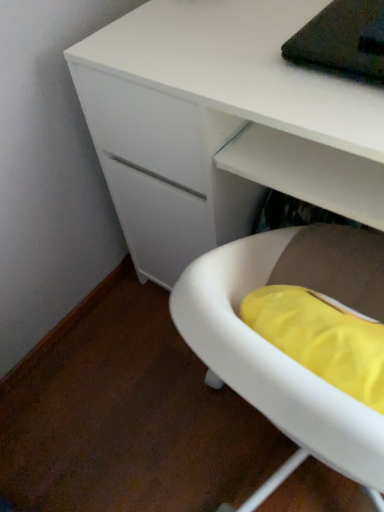
Question: Is white plastic tub at lower right at the left side of white matte desk at center?

Choices:
 (A) yes
 (B) no

Answer: (A)

Question: From the image's perspective, is white plastic tub at lower right below white matte desk at center?

Choices:
 (A) no
 (B) yes

Answer: (B)

Question: Considering the relative sizes of white plastic tub at lower right and white matte desk at center in the image provided, is white plastic tub at lower right bigger than white matte desk at center?

Choices:
 (A) yes
 (B) no

Answer: (B)

Question: From a real-world perspective, is white plastic tub at lower right positioned under white matte desk at center based on gravity?

Choices:
 (A) no
 (B) yes

Answer: (A)

Question: Is white plastic tub at lower right positioned behind white matte desk at center?

Choices:
 (A) no
 (B) yes

Answer: (A)

Question: Is white plastic tub at lower right positioned with its back to white matte desk at center?

Choices:
 (A) yes
 (B) no

Answer: (B)

Question: From a real-world perspective, is white matte desk at center below white plastic tub at lower right?

Choices:
 (A) no
 (B) yes

Answer: (B)

Question: Is white matte desk at center facing away from white plastic tub at lower right?

Choices:
 (A) yes
 (B) no

Answer: (B)

Question: Can you confirm if white matte desk at center is taller than white plastic tub at lower right?

Choices:
 (A) yes
 (B) no

Answer: (A)

Question: Can you confirm if white matte desk at center is thinner than white plastic tub at lower right?

Choices:
 (A) no
 (B) yes

Answer: (A)

Question: Is the depth of white matte desk at center less than that of white plastic tub at lower right?

Choices:
 (A) no
 (B) yes

Answer: (A)

Question: Are white matte desk at center and white plastic tub at lower right located far from each other?

Choices:
 (A) yes
 (B) no

Answer: (B)

Question: From a real-world perspective, relative to white matte desk at center, is white plastic tub at lower right vertically above or below?

Choices:
 (A) above
 (B) below

Answer: (A)